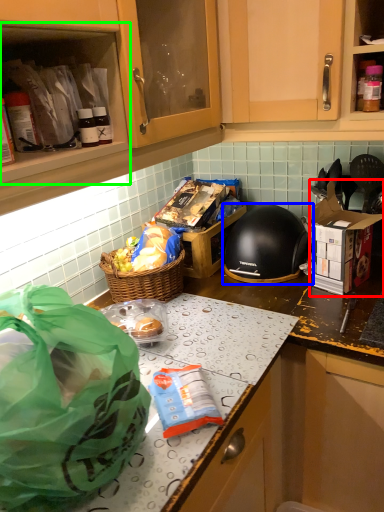
Question: Considering the real-world distances, which object is closest to cardboard box (highlighted by a red box)? helmet (highlighted by a blue box) or cabinetry (highlighted by a green box).

Choices:
 (A) helmet
 (B) cabinetry

Answer: (A)